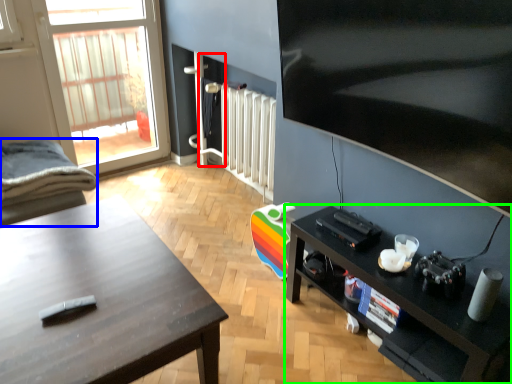
Question: Which object is positioned farthest from screen door (highlighted by a red box)? Select from chair (highlighted by a blue box) and shelf (highlighted by a green box).

Choices:
 (A) chair
 (B) shelf

Answer: (B)